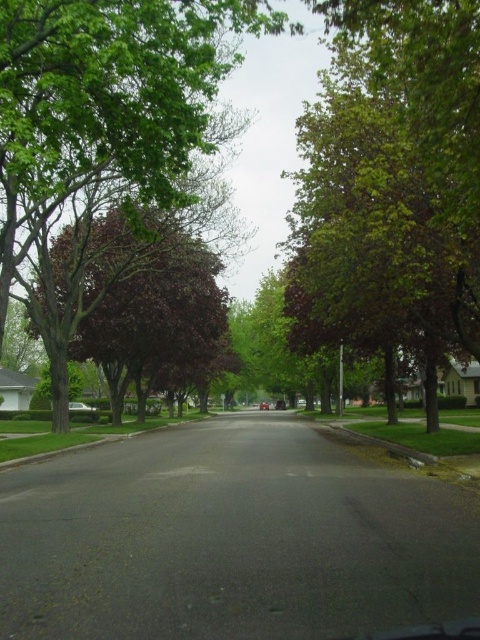
You are standing at the point labeled as point (107, 100) in the suburban street scene. What object is this point located on?

The point (107, 100) is located on the green leafy tree at center.

You are standing at the starting point of the suburban street and see two points marked on the ground. The first point is at point(72, 401) and the second is at point(264, 406). Which point is closer to you?

Point(72, 401) is closer to you because it is in front of point(264, 406).